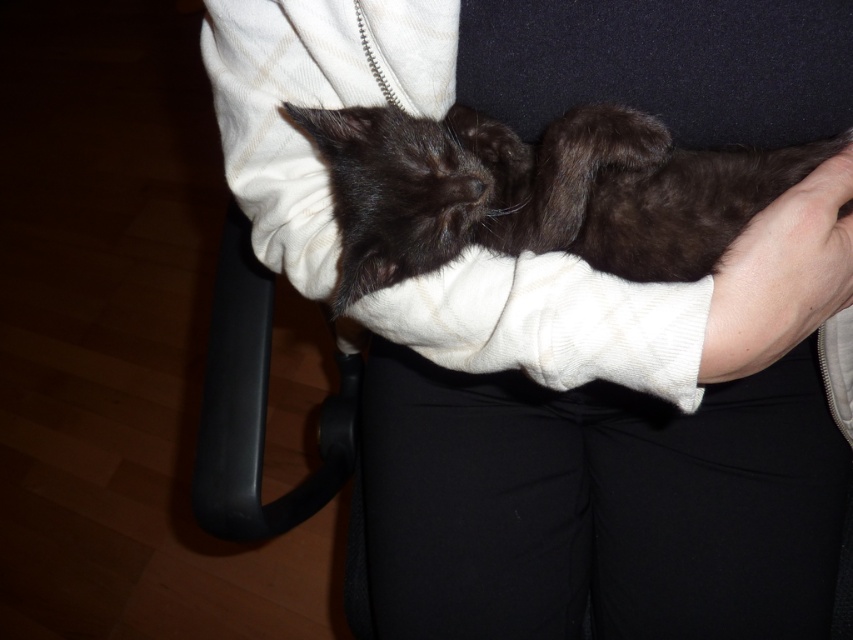
Question: Among these points, which one is farthest from the camera?

Choices:
 (A) (795, 296)
 (B) (645, 204)

Answer: (B)

Question: Estimate the real-world distances between objects in this image. Which object is farther from the black fluffy cat at center?

Choices:
 (A) black plastic armrest at lower left
 (B) smooth skin at lower right

Answer: (A)

Question: Does black fluffy cat at center have a larger size compared to smooth skin at lower right?

Choices:
 (A) yes
 (B) no

Answer: (A)

Question: Does black fluffy cat at center have a smaller size compared to smooth skin at lower right?

Choices:
 (A) no
 (B) yes

Answer: (A)

Question: Which object is closer to the camera taking this photo?

Choices:
 (A) black fluffy cat at center
 (B) smooth skin at lower right

Answer: (B)

Question: Does black fluffy cat at center have a smaller size compared to black plastic armrest at lower left?

Choices:
 (A) yes
 (B) no

Answer: (A)